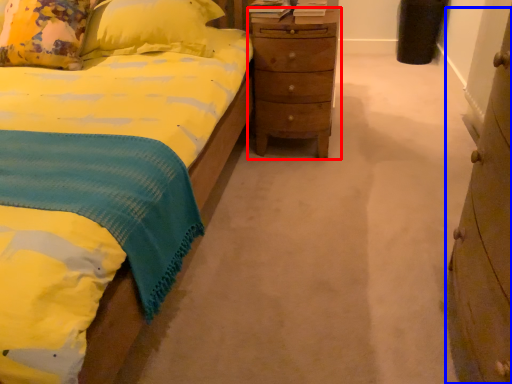
Question: Which of the following is the closest to the observer, nightstand (highlighted by a red box) or chest of drawers (highlighted by a blue box)?

Choices:
 (A) nightstand
 (B) chest of drawers

Answer: (B)